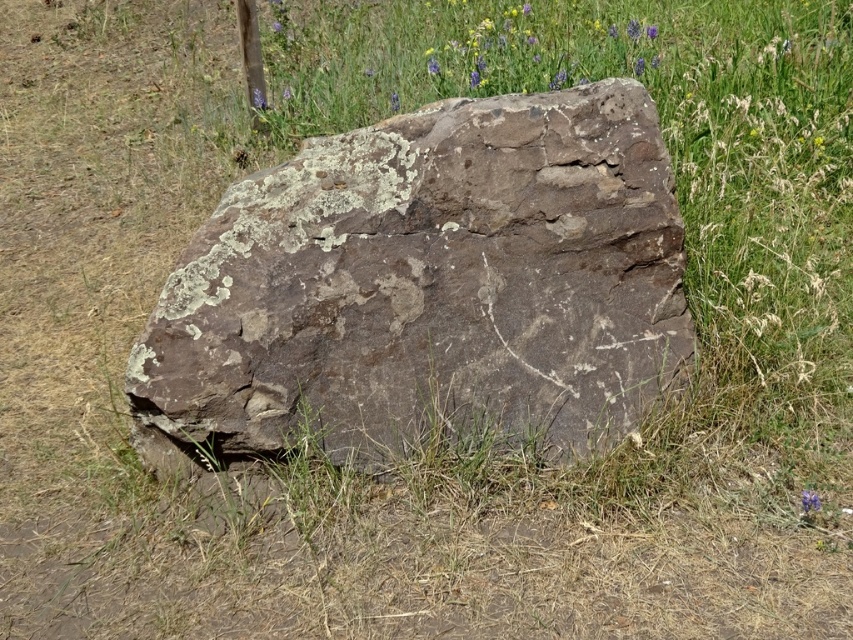
Question: Which point is farther to the camera?

Choices:
 (A) (264, 276)
 (B) (445, 76)

Answer: (B)

Question: Can you confirm if brown rough rock at center is bigger than blue textured flowers at upper center?

Choices:
 (A) no
 (B) yes

Answer: (A)

Question: Is brown rough rock at center positioned in front of blue textured flowers at upper center?

Choices:
 (A) yes
 (B) no

Answer: (A)

Question: Does brown rough rock at center appear over blue textured flowers at upper center?

Choices:
 (A) no
 (B) yes

Answer: (A)

Question: Which object appears farthest from the camera in this image?

Choices:
 (A) brown rough rock at center
 (B) blue textured flowers at upper center

Answer: (B)